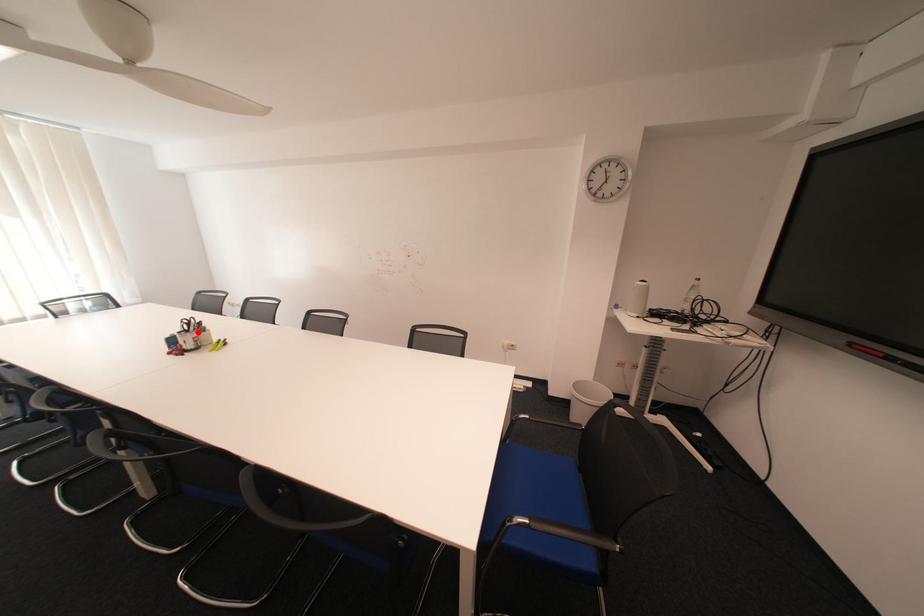
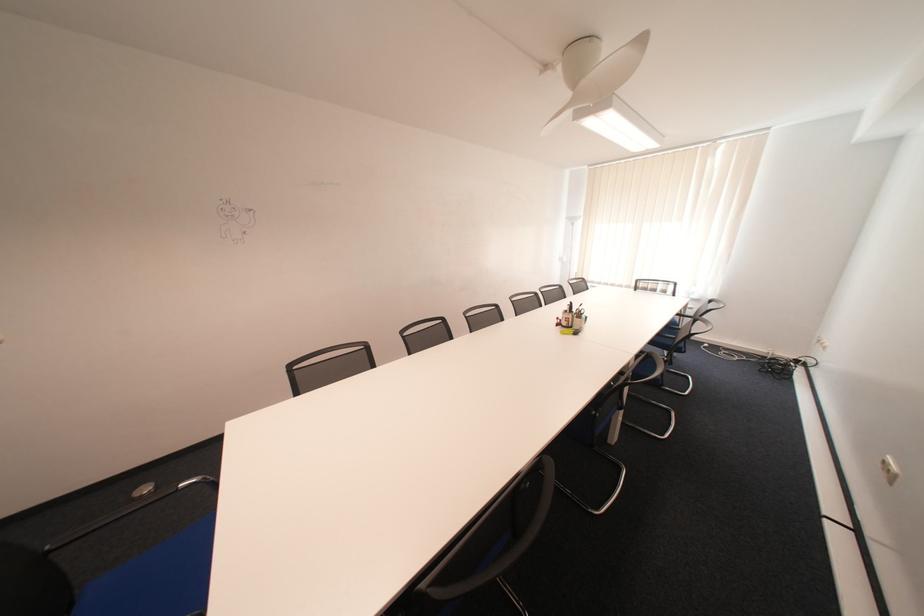
Find the pixel in the second image that matches the highlighted location in the first image.

(578, 312)